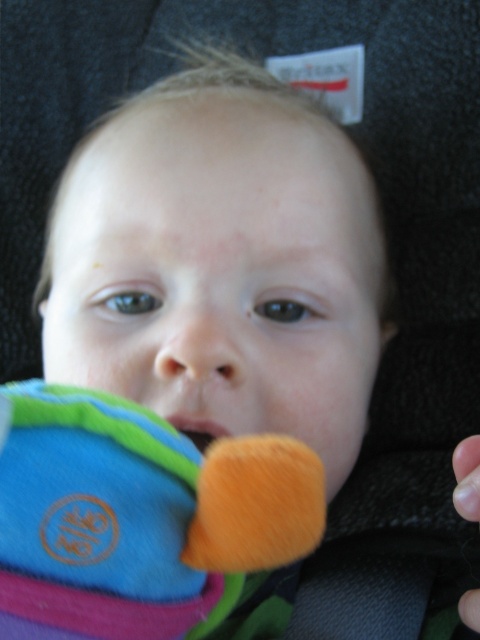
Question: Is soft plush toy at lower left positioned at the back of matte orange mouth at center?

Choices:
 (A) yes
 (B) no

Answer: (B)

Question: Which point is farther to the camera?

Choices:
 (A) soft plush toy at lower left
 (B) matte orange mouth at center

Answer: (B)

Question: Which of the following is the farthest from the observer?

Choices:
 (A) soft plush toy at lower left
 (B) matte orange mouth at center

Answer: (B)

Question: Does soft plush toy at lower left have a larger size compared to matte orange mouth at center?

Choices:
 (A) yes
 (B) no

Answer: (A)

Question: In this image, where is soft plush toy at lower left located relative to matte orange mouth at center?

Choices:
 (A) below
 (B) above

Answer: (A)